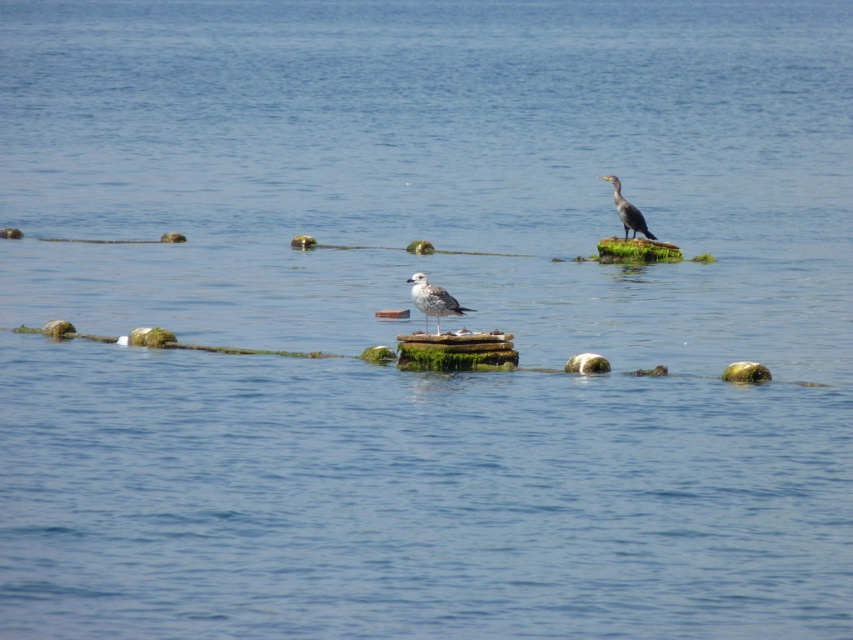
Question: Is white feathered bird at center further to the viewer compared to dark gray feathers at upper right?

Choices:
 (A) yes
 (B) no

Answer: (B)

Question: Which object is closer to the camera taking this photo?

Choices:
 (A) white feathered bird at center
 (B) dark gray feathers at upper right

Answer: (A)

Question: Which object appears closest to the camera in this image?

Choices:
 (A) dark gray feathers at upper right
 (B) white feathered bird at center

Answer: (B)

Question: Observing the image, what is the correct spatial positioning of white feathered bird at center in reference to dark gray feathers at upper right?

Choices:
 (A) left
 (B) right

Answer: (A)

Question: Does white feathered bird at center have a smaller size compared to dark gray feathers at upper right?

Choices:
 (A) yes
 (B) no

Answer: (A)